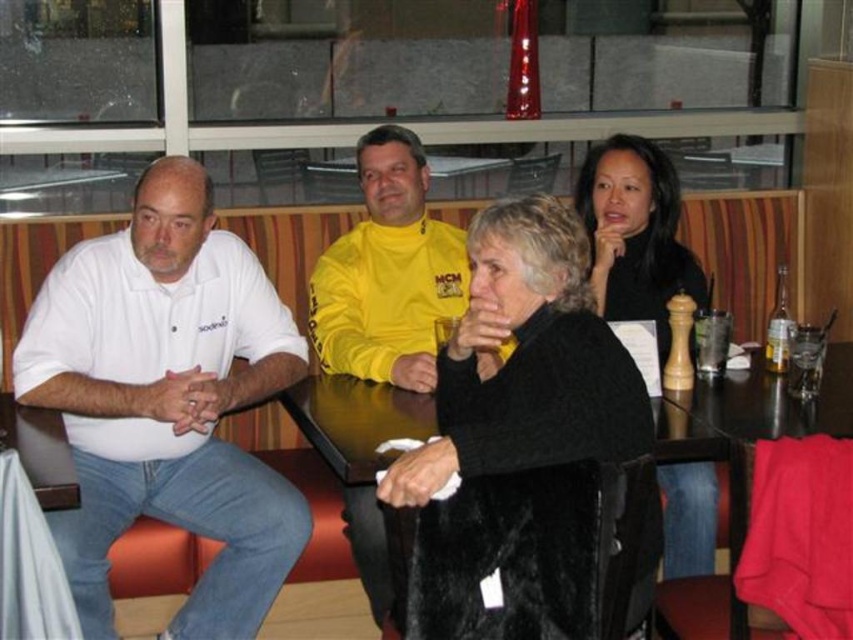
Question: Is black fuzzy coat at center further to camera compared to yellow fleece jacket at center?

Choices:
 (A) no
 (B) yes

Answer: (A)

Question: Which point is closer to the camera taking this photo?

Choices:
 (A) (488, 403)
 (B) (335, 284)

Answer: (A)

Question: Which point is farther to the camera?

Choices:
 (A) (416, 202)
 (B) (668, 225)
 (C) (451, 541)

Answer: (A)

Question: Does white cotton shirt at left have a larger size compared to black fuzzy coat at center?

Choices:
 (A) no
 (B) yes

Answer: (B)

Question: Is black fuzzy coat at center bigger than yellow fleece jacket at center?

Choices:
 (A) yes
 (B) no

Answer: (B)

Question: Which point appears farthest from the camera in this image?

Choices:
 (A) (370, 362)
 (B) (529, 348)
 (C) (619, 168)
 (D) (135, 381)

Answer: (C)